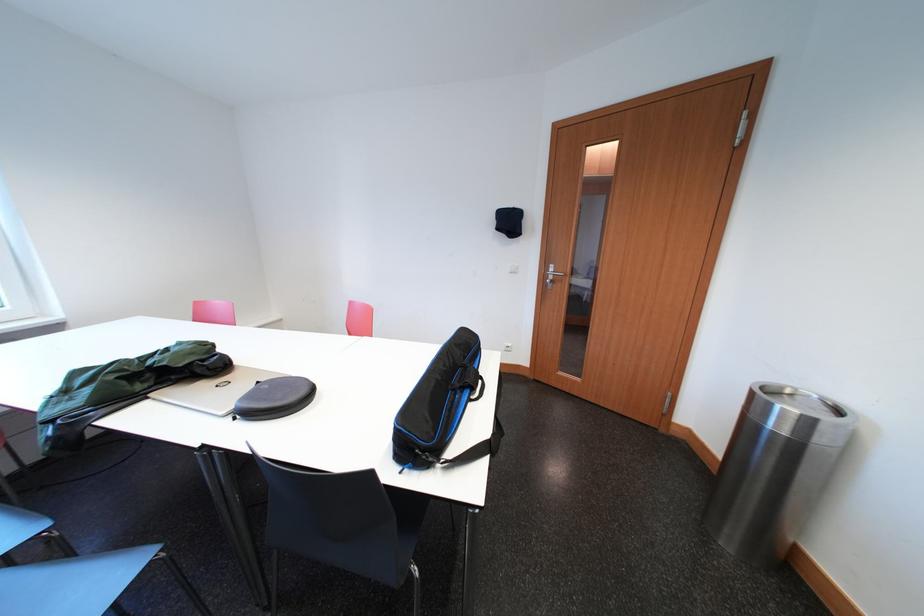
The width and height of the screenshot is (924, 616). What do you see at coordinates (513, 268) in the screenshot?
I see `the white light switch` at bounding box center [513, 268].